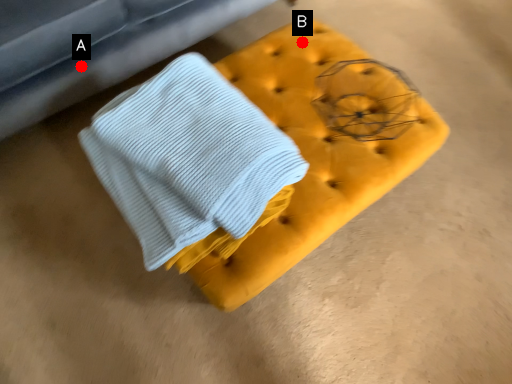
Question: Two points are circled on the image, labeled by A and B beside each circle. Among these points, which one is farthest from the camera?

Choices:
 (A) A is further
 (B) B is further

Answer: (A)